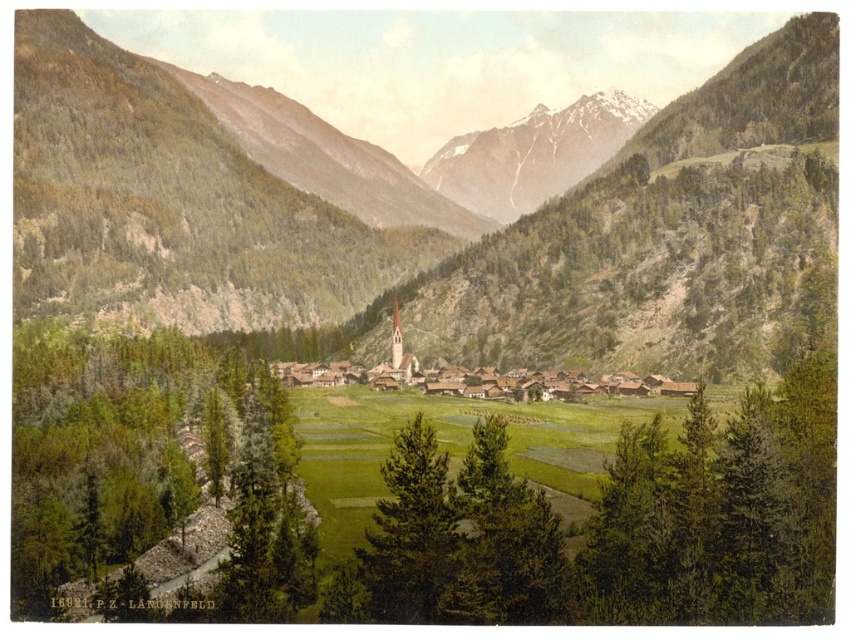
Can you confirm if snowy granite mountain at upper center is positioned above wooden houses at center?

Correct, snowy granite mountain at upper center is located above wooden houses at center.

Is snowy granite mountain at upper center shorter than wooden houses at center?

In fact, snowy granite mountain at upper center may be taller than wooden houses at center.

Measure the distance between snowy granite mountain at upper center and camera.

snowy granite mountain at upper center is 1773.61 feet away from camera.

This screenshot has width=851, height=640. Identify the location of snowy granite mountain at upper center. pos(533,154).

Describe the element at coordinates (615, 525) in the screenshot. I see `green textured tree at center` at that location.

Does green textured tree at center have a greater height compared to wooden houses at center?

Correct, green textured tree at center is much taller as wooden houses at center.

Consider the image. Who is more forward, (381,572) or (426,376)?

Point (381,572) is more forward.

Find the location of a particular element. The width and height of the screenshot is (851, 640). green textured tree at center is located at coordinates (615, 525).

Is point (743, 342) less distant than point (568, 387)?

Yes, it is in front of point (568, 387).

Can you confirm if green grassy field at center is bigger than wooden houses at center?

Correct, green grassy field at center is larger in size than wooden houses at center.

Between point (277, 321) and point (297, 372), which one is positioned in front?

Point (297, 372) is more forward.

Locate an element on the screen. green grassy field at center is located at coordinates (661, 240).